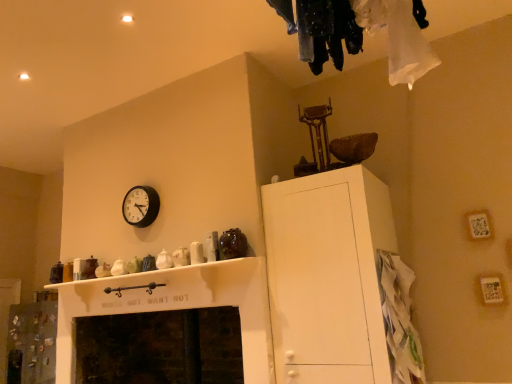
Question: From a real-world perspective, is dark stone fireplace at lower center physically above white matte cabinet at upper right?

Choices:
 (A) yes
 (B) no

Answer: (B)

Question: Can you confirm if dark stone fireplace at lower center is wider than white matte cabinet at upper right?

Choices:
 (A) yes
 (B) no

Answer: (B)

Question: From the image's perspective, is dark stone fireplace at lower center on white matte cabinet at upper right?

Choices:
 (A) yes
 (B) no

Answer: (B)

Question: Does dark stone fireplace at lower center have a larger size compared to white matte cabinet at upper right?

Choices:
 (A) no
 (B) yes

Answer: (A)

Question: Is dark stone fireplace at lower center outside white matte cabinet at upper right?

Choices:
 (A) yes
 (B) no

Answer: (A)

Question: Is dark stone fireplace at lower center in front of white matte cabinet at upper right?

Choices:
 (A) no
 (B) yes

Answer: (A)

Question: From the image's perspective, is black plastic clock at upper left on dark stone fireplace at lower center?

Choices:
 (A) yes
 (B) no

Answer: (A)

Question: Is black plastic clock at upper left positioned behind dark stone fireplace at lower center?

Choices:
 (A) yes
 (B) no

Answer: (A)

Question: Considering the relative positions of black plastic clock at upper left and dark stone fireplace at lower center in the image provided, is black plastic clock at upper left to the left of dark stone fireplace at lower center from the viewer's perspective?

Choices:
 (A) no
 (B) yes

Answer: (B)

Question: Could you tell me if black plastic clock at upper left is turned towards dark stone fireplace at lower center?

Choices:
 (A) no
 (B) yes

Answer: (A)

Question: Could dark stone fireplace at lower center be considered to be inside black plastic clock at upper left?

Choices:
 (A) no
 (B) yes

Answer: (A)

Question: Is black plastic clock at upper left positioned with its back to dark stone fireplace at lower center?

Choices:
 (A) no
 (B) yes

Answer: (A)

Question: Is dark stone fireplace at lower center positioned behind white paper bag at lower right?

Choices:
 (A) no
 (B) yes

Answer: (B)